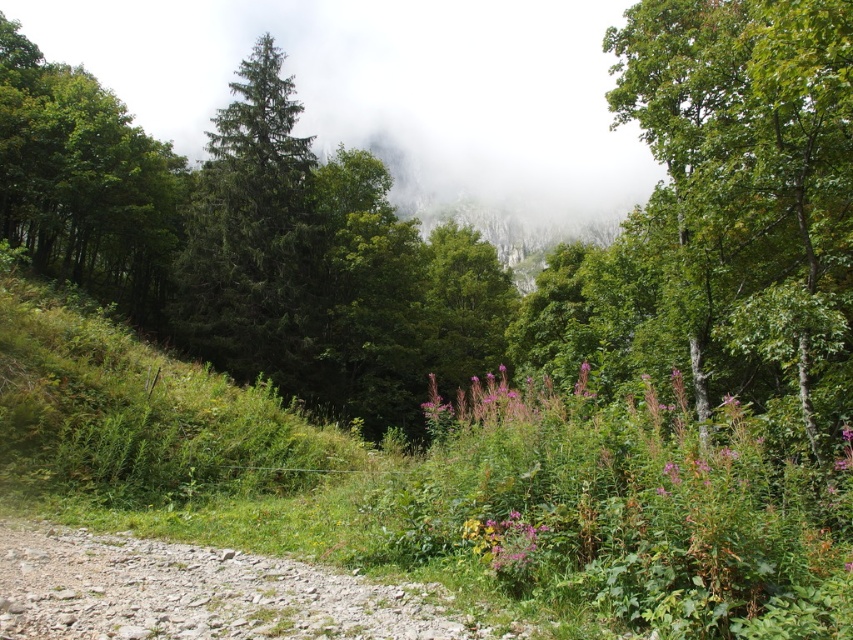
In the scene shown: You are a hiker who wants to know which object is taller between the dusty gravel path at lower left and the green matte evergreen tree at center. Can you tell me which one is taller?

The green matte evergreen tree at center is taller than the dusty gravel path at lower left.

You are a hiker trying to navigate through the gravel path. You have a 2m wide tent that you need to set up. The gravel path is narrow, and you want to ensure there is enough space. Considering the green matte evergreen tree at center and the dusty gravel path at lower left, which one is wider?

The dusty gravel path at lower left is narrower than the green matte evergreen tree at center. Therefore, the gravel path may not be wide enough to accommodate your 2m wide tent. You should look for a wider area or consider setting up near the base of the green matte evergreen tree at center where there might be more space.